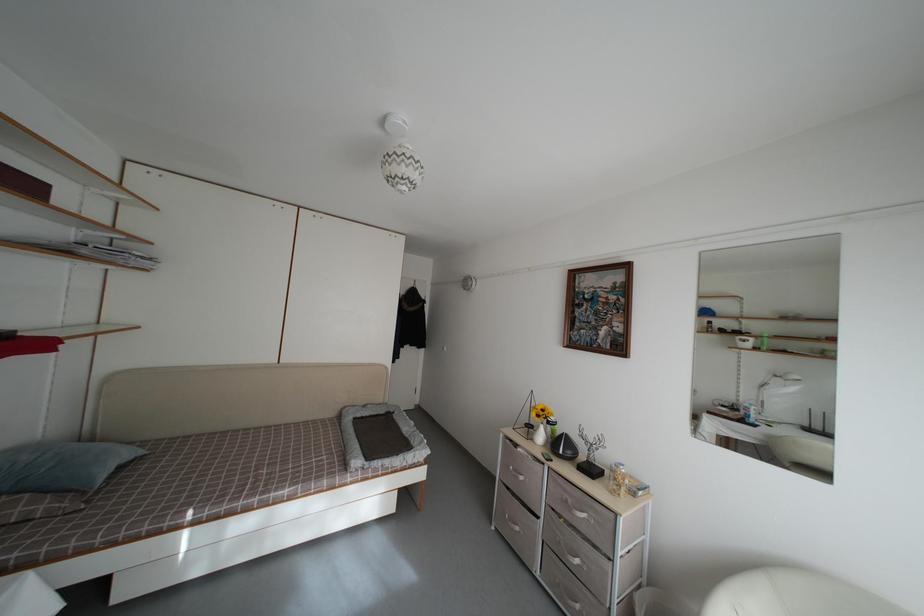
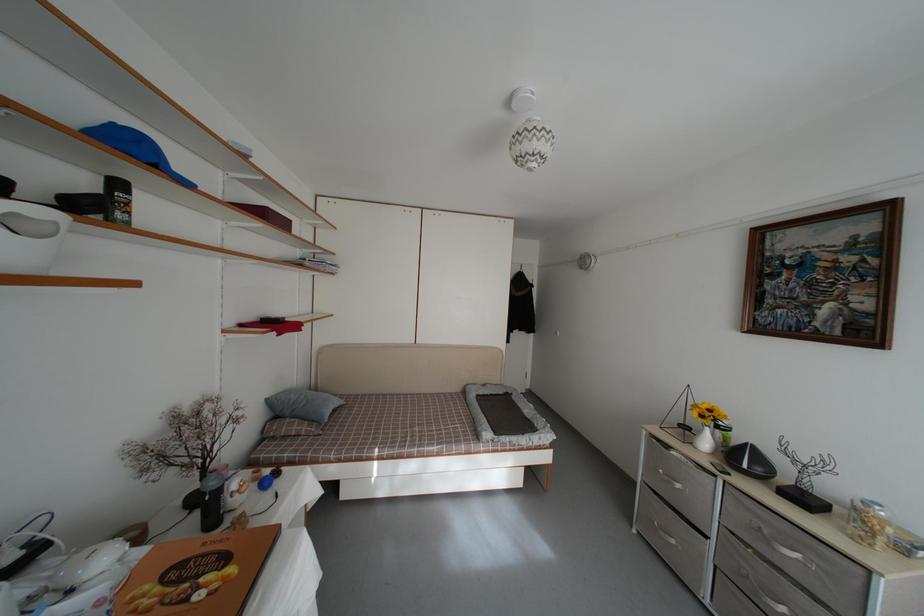
In the second image, find the point that corresponds to (x=524, y=535) in the first image.

(678, 548)